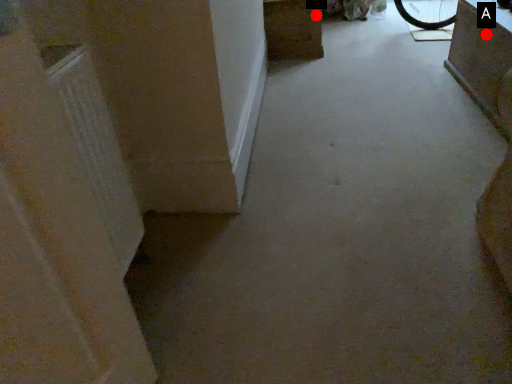
Question: Two points are circled on the image, labeled by A and B beside each circle. Which of the following is the closest to the observer?

Choices:
 (A) A is closer
 (B) B is closer

Answer: (A)